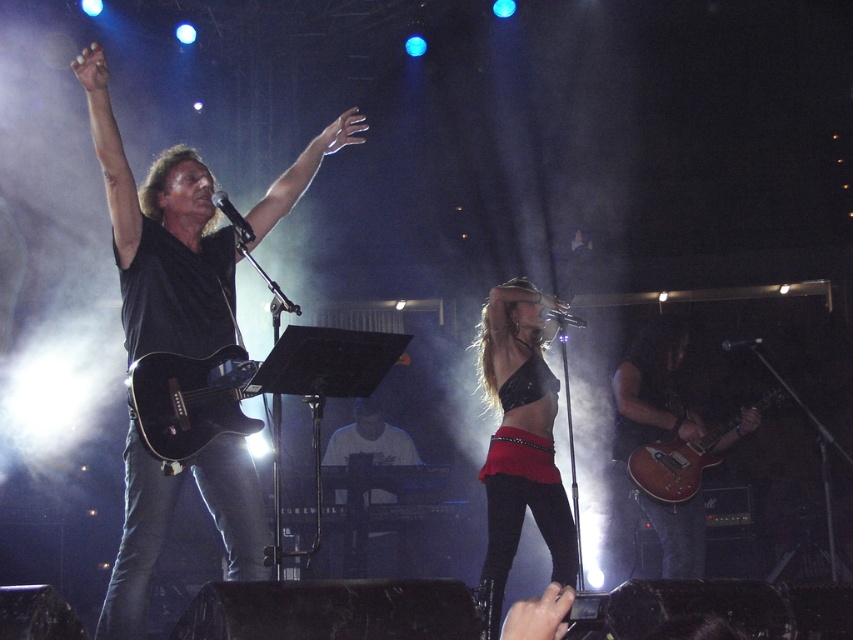
Can you confirm if black matte guitar at upper left is positioned to the right of black leather bra at center?

In fact, black matte guitar at upper left is to the left of black leather bra at center.

Does black matte guitar at upper left appear under black leather bra at center?

Incorrect, black matte guitar at upper left is not positioned below black leather bra at center.

This screenshot has height=640, width=853. What are the coordinates of `black matte guitar at upper left` in the screenshot? It's located at (161, 236).

Locate an element on the screen. This screenshot has width=853, height=640. black matte guitar at upper left is located at coordinates (161, 236).

What do you see at coordinates (519, 442) in the screenshot? This screenshot has height=640, width=853. I see `black leather bra at center` at bounding box center [519, 442].

Is black leather bra at center above white matte keyboard at center?

Yes.

The image size is (853, 640). What do you see at coordinates (519, 442) in the screenshot?
I see `black leather bra at center` at bounding box center [519, 442].

Locate an element on the screen. black leather bra at center is located at coordinates (519, 442).

Which is in front, point (207, 374) or point (337, 451)?

Positioned in front is point (207, 374).

Does point (250, 369) come closer to viewer compared to point (374, 448)?

Yes.

The width and height of the screenshot is (853, 640). What do you see at coordinates (189, 401) in the screenshot? I see `glossy black guitar at center` at bounding box center [189, 401].

The height and width of the screenshot is (640, 853). I want to click on glossy black guitar at center, so click(x=189, y=401).